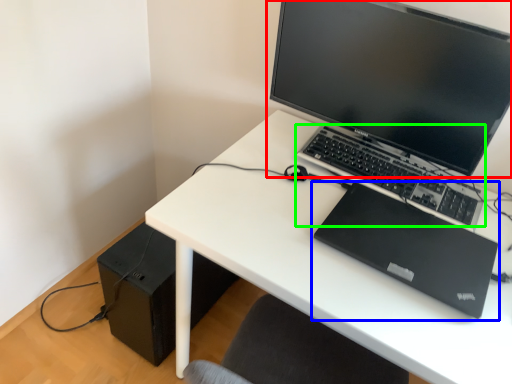
Question: Which object is the farthest from computer monitor (highlighted by a red box)? Choose among these: laptop (highlighted by a blue box) or computer keyboard (highlighted by a green box).

Choices:
 (A) laptop
 (B) computer keyboard

Answer: (A)